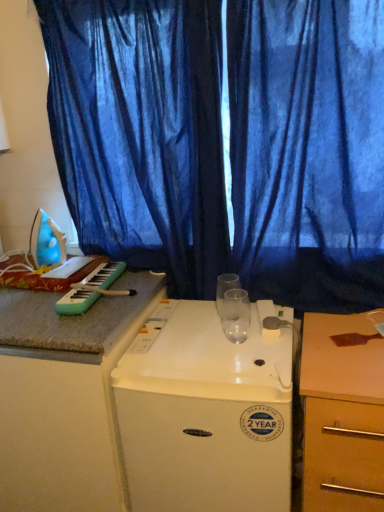
Image resolution: width=384 pixels, height=512 pixels. I want to click on vacant space situated above green plastic keyboard at left (from a real-world perspective), so click(95, 275).